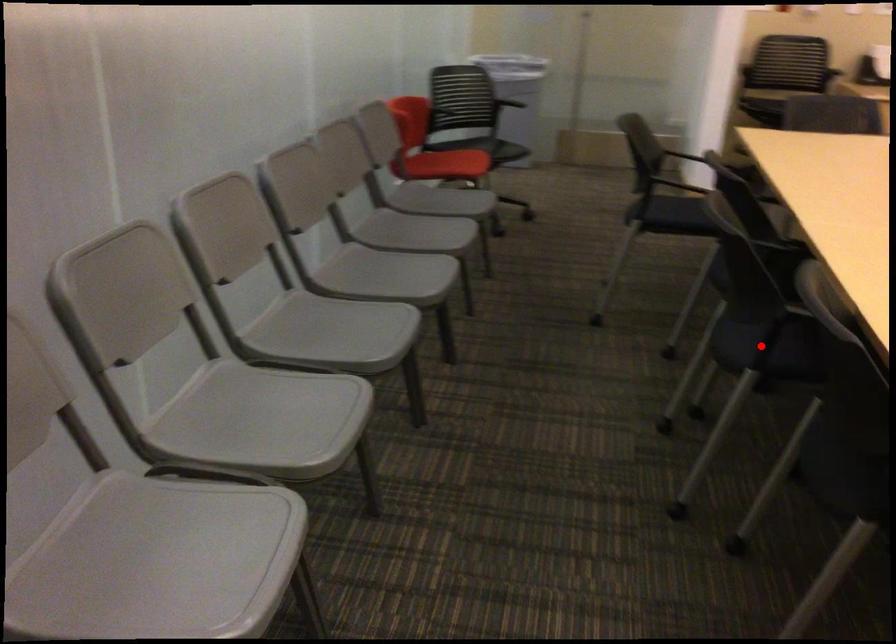
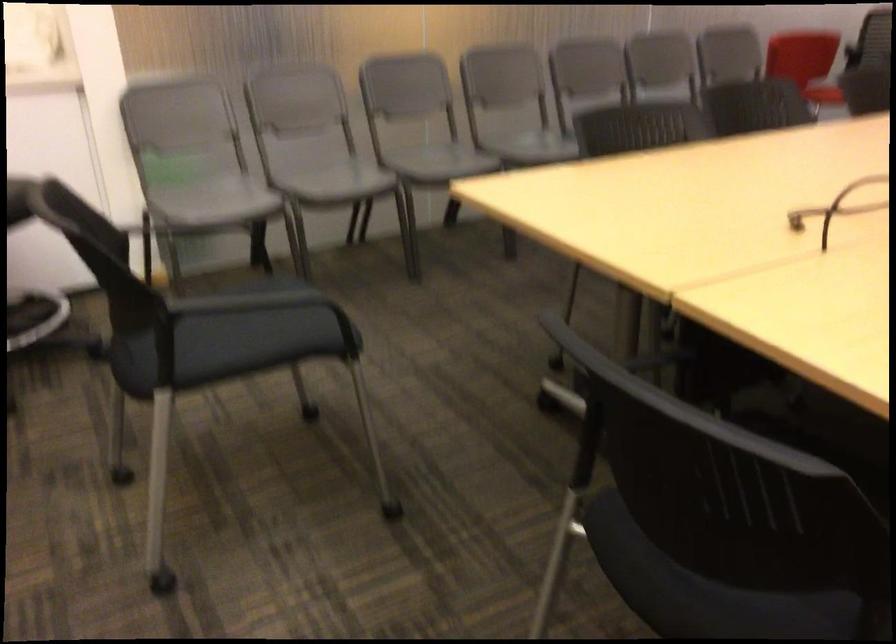
Question: I am providing you with two images of the same scene from different viewpoints. A red point is marked on the first image. Is the red point's position out of view in image 2?

Choices:
 (A) Yes
 (B) No

Answer: (A)